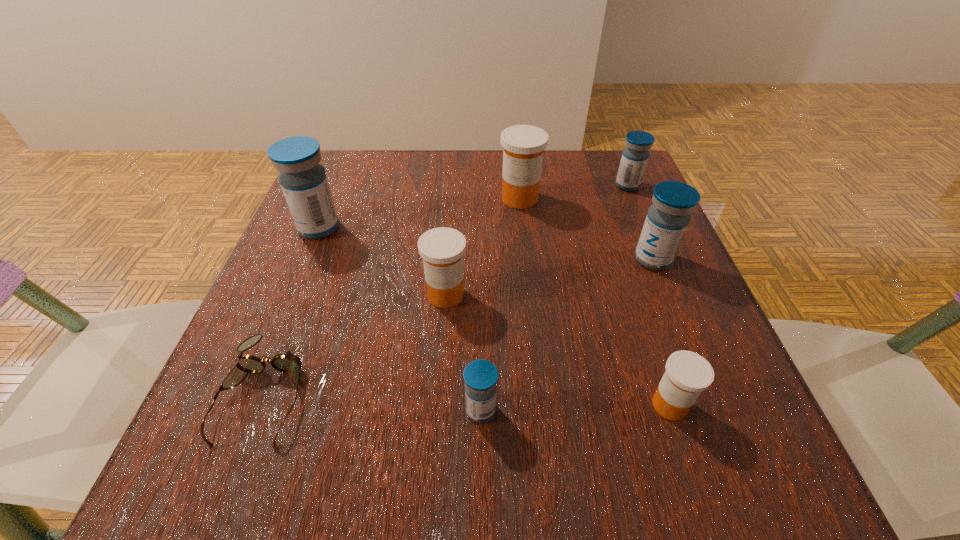
This screenshot has height=540, width=960. I want to click on free location at the right edge, so click(x=612, y=239).

This screenshot has height=540, width=960. Identify the location of free spot between the nearest blue medicine and the shortest object. (372, 402).

Locate an element on the screen. free space between the leftmost orange medicine and the leftmost medicine is located at coordinates (382, 261).

Image resolution: width=960 pixels, height=540 pixels. What are the coordinates of `free spot between the fifth medicine from right to left and the second biggest blue medicine` in the screenshot? It's located at (567, 334).

I want to click on empty space between the farthest orange medicine and the farthest blue medicine, so click(x=574, y=192).

This screenshot has width=960, height=540. In order to click on unoccupied position between the fifth nearest object and the smallest orange medicine in this screenshot , I will do `click(661, 332)`.

Find the location of a particular element. free spot between the biggest orange medicine and the shortest object is located at coordinates (393, 296).

Find the location of `free spot between the second smallest orange medicine and the fifth object from left to right`. free spot between the second smallest orange medicine and the fifth object from left to right is located at coordinates (483, 247).

Image resolution: width=960 pixels, height=540 pixels. In order to click on empty space between the fifth nearest object and the third nearest medicine in this screenshot , I will do `click(549, 277)`.

This screenshot has width=960, height=540. Find the location of `vacant space that's between the second orange medicine from left to right and the fourth farthest object`. vacant space that's between the second orange medicine from left to right and the fourth farthest object is located at coordinates (587, 229).